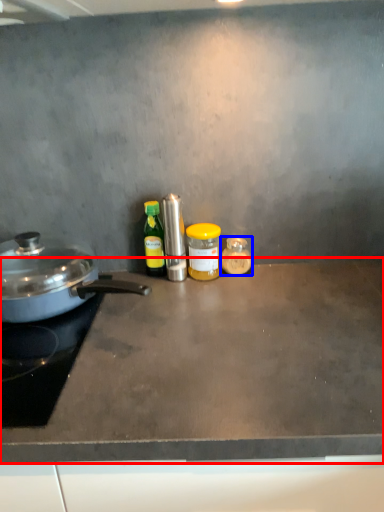
Question: Which object appears farthest to the camera in this image, countertop (highlighted by a red box) or kitchen appliance (highlighted by a blue box)?

Choices:
 (A) countertop
 (B) kitchen appliance

Answer: (B)